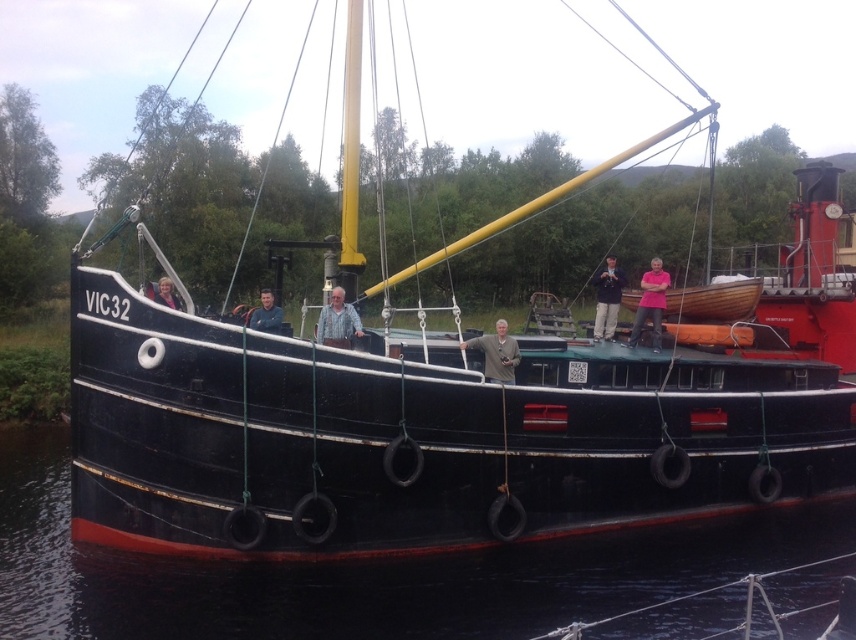
Does black rubber tires at lower center have a greater width compared to light brown wooden pole at center?

Yes, black rubber tires at lower center is wider than light brown wooden pole at center.

Who is higher up, black rubber tires at lower center or light brown wooden pole at center?

Positioned higher is light brown wooden pole at center.

Image resolution: width=856 pixels, height=640 pixels. In order to click on black rubber tires at lower center in this screenshot , I will do `click(361, 573)`.

Image resolution: width=856 pixels, height=640 pixels. I want to click on black rubber tires at lower center, so tap(361, 573).

Which is more to the left, gray fabric jacket at center or light brown wooden pole at center?

light brown wooden pole at center is more to the left.

Can you confirm if gray fabric jacket at center is thinner than light brown wooden pole at center?

Incorrect, gray fabric jacket at center's width is not less than light brown wooden pole at center's.

Does point (500, 376) come in front of point (330, 314)?

No, (500, 376) is further to viewer.

Locate an element on the screen. gray fabric jacket at center is located at coordinates (496, 353).

Does black rubber tires at lower center appear under dark blue shirt at center?

Yes, black rubber tires at lower center is below dark blue shirt at center.

Can you confirm if black rubber tires at lower center is positioned to the left of dark blue shirt at center?

Indeed, black rubber tires at lower center is positioned on the left side of dark blue shirt at center.

Locate an element on the screen. black rubber tires at lower center is located at coordinates (361, 573).

This screenshot has width=856, height=640. Identify the location of black rubber tires at lower center. (361, 573).